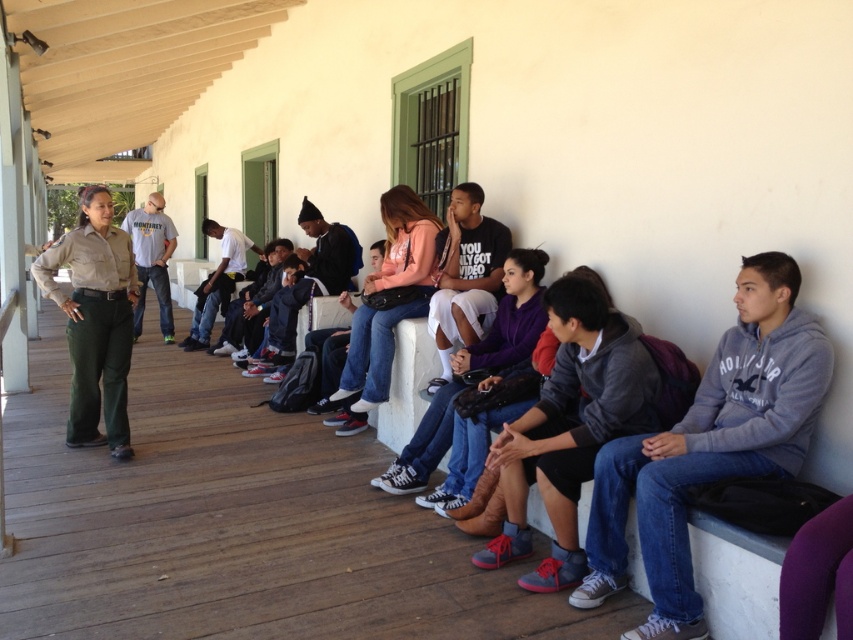
You are a photographer trying to capture a candid shot of the group on the bench. You notice the gray fleece sweatshirt at center and the khaki uniform pants at left. Which clothing item would you need to adjust your camera angle to focus on first if you want to capture both in the same frame?

The gray fleece sweatshirt at center is shorter than the khaki uniform pants at left, so you should focus on the khaki uniform pants at left first to ensure it fits within the frame before adjusting for the shorter sweatshirt.

You are standing in front of the bench and want to hand a note to the person wearing the gray fleece sweatshirt at center and the light gray cotton shirt at center. Which one can you reach first without moving your position?

The gray fleece sweatshirt at center is closer to the viewer than the light gray cotton shirt at center, so you can reach the person wearing the gray fleece sweatshirt at center first without moving your position.

You are standing on the wooden floor of the porch and see the khaki uniform pants at left and the light gray cotton shirt at center. Which object is positioned lower in the scene?

The khaki uniform pants at left is below the light gray cotton shirt at center, so the khaki uniform pants at left is positioned lower in the scene.